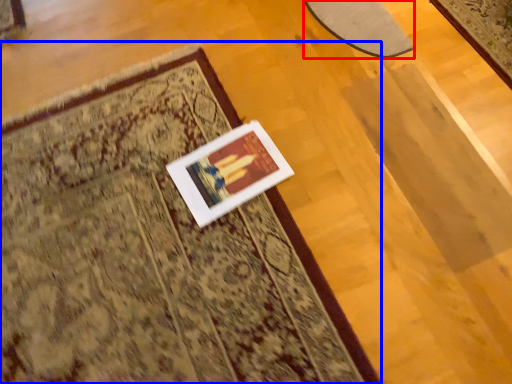
Question: Which point is further to the camera, mat (highlighted by a red box) or mat (highlighted by a blue box)?

Choices:
 (A) mat
 (B) mat

Answer: (A)